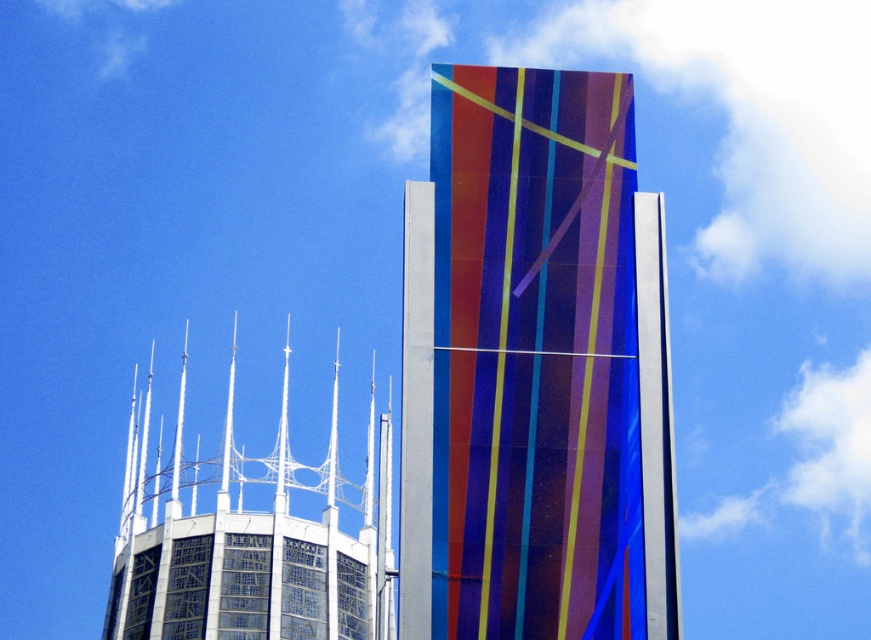
Who is taller, translucent glass tower at center or white glass spires at upper center?

With more height is white glass spires at upper center.

Who is positioned more to the right, translucent glass tower at center or white glass spires at upper center?

translucent glass tower at center is more to the right.

Locate an element on the screen. translucent glass tower at center is located at coordinates (534, 369).